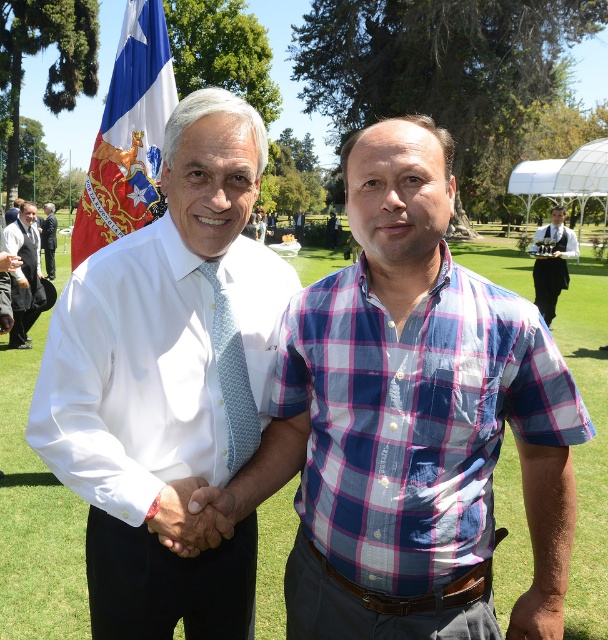
You are a photographer setting up for a group photo. You need to position two men wearing the blue plaid shirt at center and the white shirt at center so that their shirts appear equally wide in the photo. Given the current arrangement, which shirt is narrower and needs to be moved closer to the camera to achieve this?

The blue plaid shirt at center has a lesser width compared to the white shirt at center. To make them appear equally wide in the photo, the blue plaid shirt at center should be moved closer to the camera since it is narrower.

What are the coordinates of the blue plaid shirt at center?

The coordinates of the blue plaid shirt at center are at point [406,412].

You are a photographer at a formal event and need to capture a group photo of the black uniform at right and the white shirt at center. Since you want to ensure both subjects are visible, which subject should you place on the left side of the frame to avoid being cut off?

The black uniform at right is positioned on the right side of white shirt at center, so to avoid being cut off, you should place the white shirt at center on the left side of the frame and the black uniform at right on the right side.